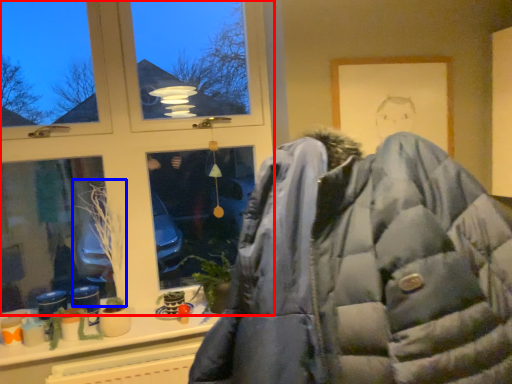
Question: Which object appears farthest to the camera in this image, window (highlighted by a red box) or plant (highlighted by a blue box)?

Choices:
 (A) window
 (B) plant

Answer: (B)